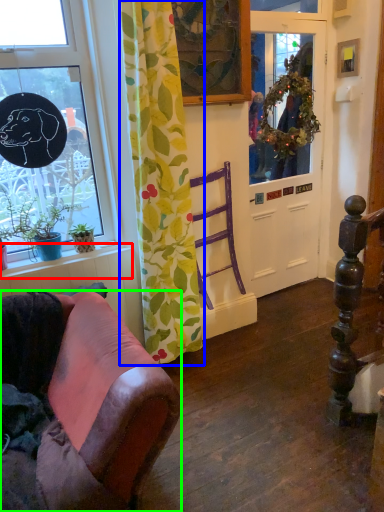
Question: Which object is the closest to the window sill (highlighted by a red box)? Choose among these: curtain (highlighted by a blue box) or chair (highlighted by a green box).

Choices:
 (A) curtain
 (B) chair

Answer: (A)